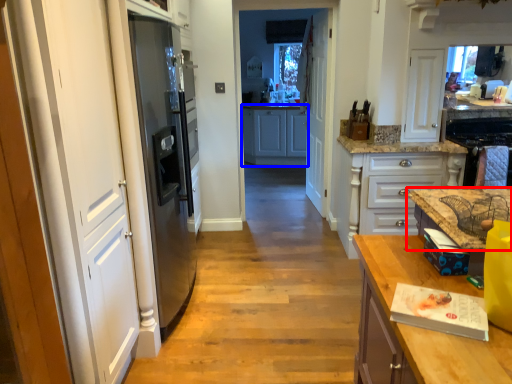
Question: Which object is closer to the camera taking this photo, countertop (highlighted by a red box) or cabinetry (highlighted by a blue box)?

Choices:
 (A) countertop
 (B) cabinetry

Answer: (A)